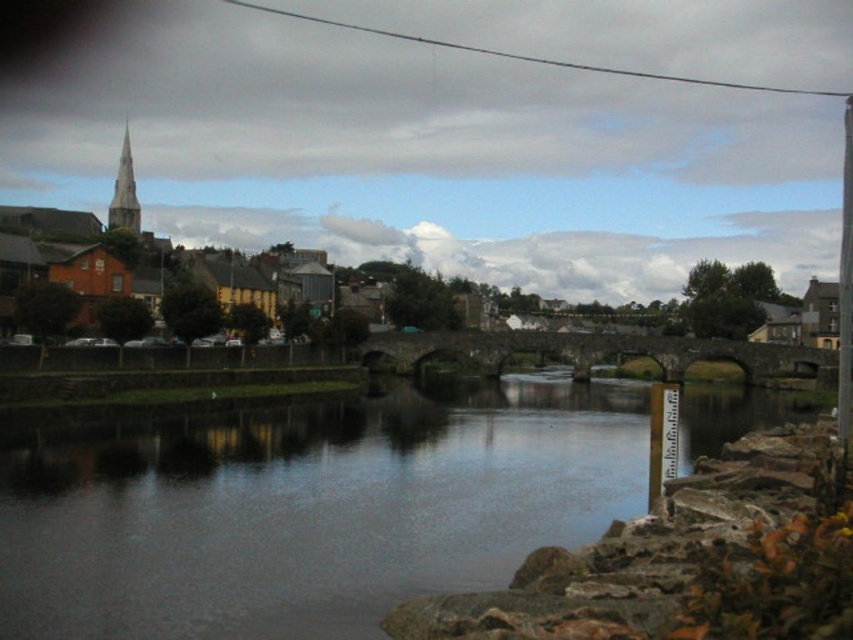
Question: Is smooth concrete river at center smaller than brown wooden houses at upper left?

Choices:
 (A) no
 (B) yes

Answer: (B)

Question: Which point appears closest to the camera in this image?

Choices:
 (A) (445, 250)
 (B) (119, 195)
 (C) (165, 481)

Answer: (C)

Question: Can you confirm if smooth concrete river at center is positioned below smooth gray spire at upper left?

Choices:
 (A) no
 (B) yes

Answer: (B)

Question: In this image, where is smooth concrete river at center located relative to smooth gray spire at upper left?

Choices:
 (A) left
 (B) right

Answer: (B)

Question: Which of the following is the closest to the observer?

Choices:
 (A) smooth concrete river at center
 (B) brown wooden houses at upper left

Answer: (A)

Question: Among these points, which one is farthest from the camera?

Choices:
 (A) (140, 132)
 (B) (131, 205)

Answer: (A)